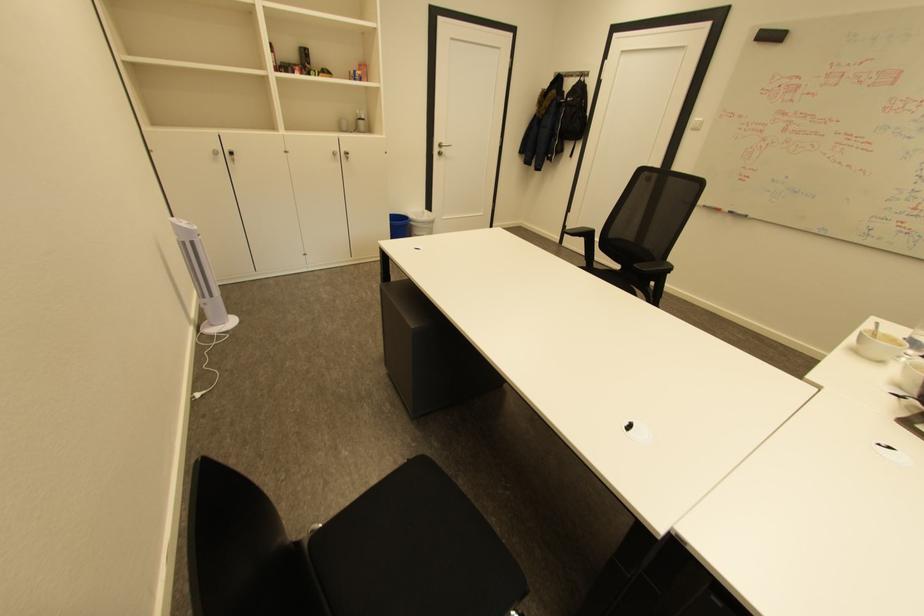
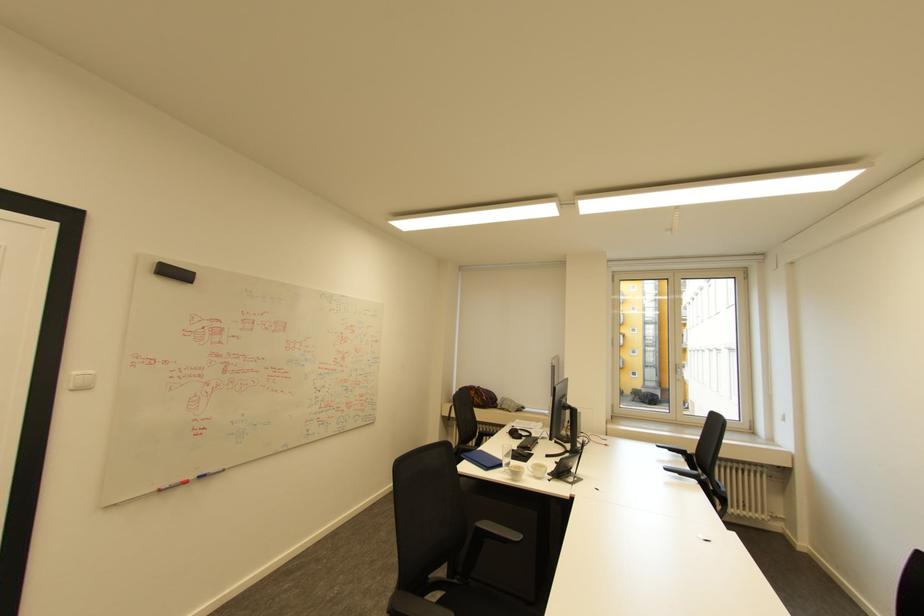
Locate, in the second image, the point that corresponds to (x=711, y=206) in the first image.

(165, 490)